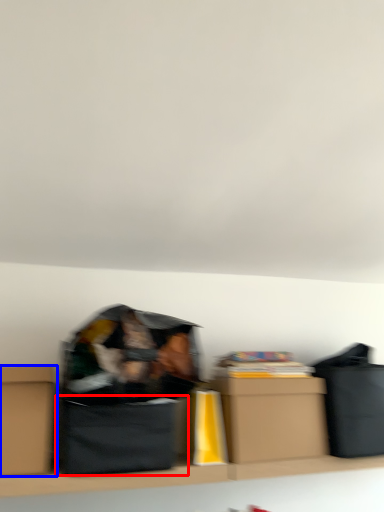
Question: Which of the following is the closest to the observer, cardboard box (highlighted by a red box) or box (highlighted by a blue box)?

Choices:
 (A) cardboard box
 (B) box

Answer: (B)